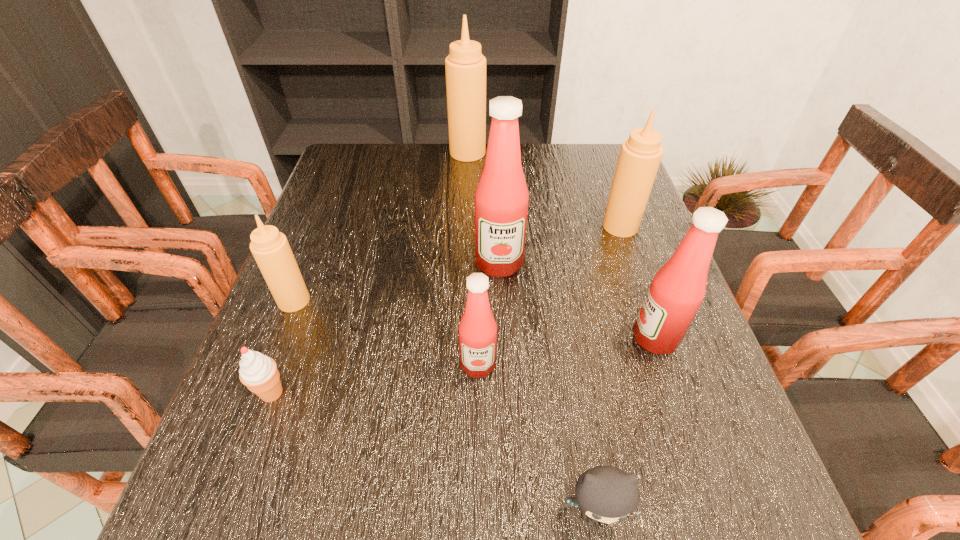
Locate an element on the screen. This screenshot has width=960, height=540. free point that satisfies the following two spatial constraints: 1. on the front-facing side of the second biggest red condiment; 2. on the front-facing side of the kitten is located at coordinates (714, 512).